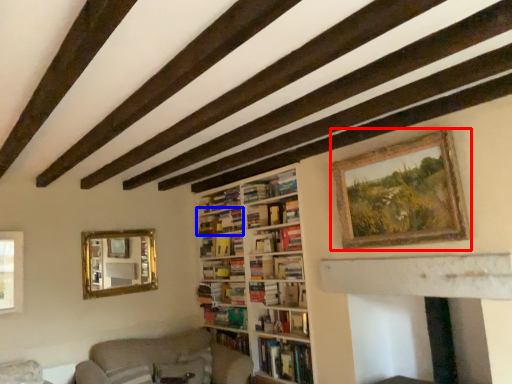
Question: Which object is closer to the camera taking this photo, picture frame (highlighted by a red box) or book (highlighted by a blue box)?

Choices:
 (A) picture frame
 (B) book

Answer: (A)